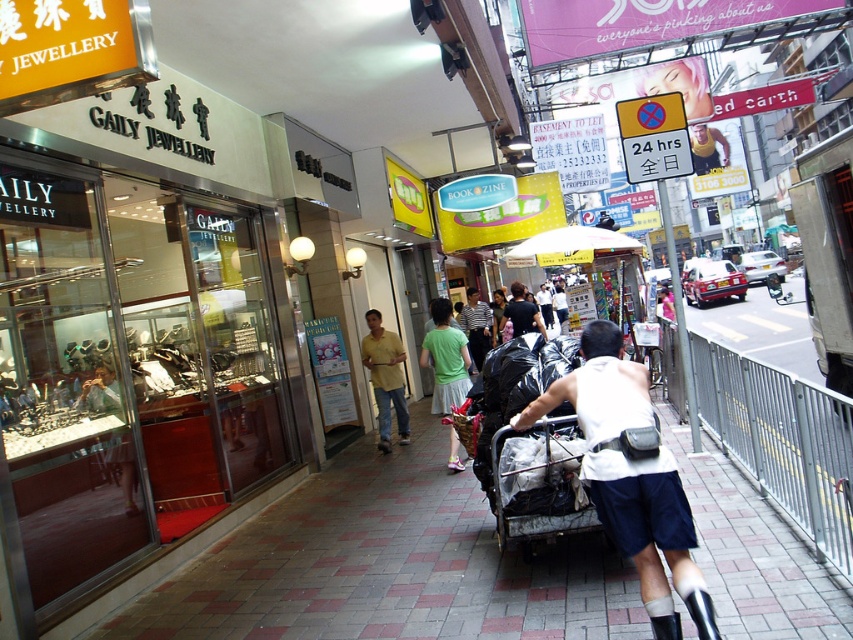
You are a customer in the GAILY JEWELLERY store and you want to hang two shirts on the store rack. The yellow cotton shirt at center and the striped cotton shirt at center are the shirts you want to hang. Which shirt should you place on the higher rack to accommodate their sizes?

The yellow cotton shirt at center should be placed on the higher rack because it has a greater height compared to the striped cotton shirt at center.

You are a customer in this store and want to try on the yellow cotton shirt at center and the striped cotton shirt at center. The salesperson says you can only try on one at a time. Which shirt should you try on first if you want to avoid blocking the view of the other shirt?

You should try on the yellow cotton shirt at center first because it is in front of the striped cotton shirt at center. If you move the yellow one, it might block the view of the striped one, but if you try the striped one first, the yellow one remains visible.

You are standing at the point marked as point (518, 461) in the image. A friend is located 4.07 meters away from you. Where is your friend standing?

Your friend is standing at the viewer position since the point (518, 461) and the viewer are 4.07 meters apart.